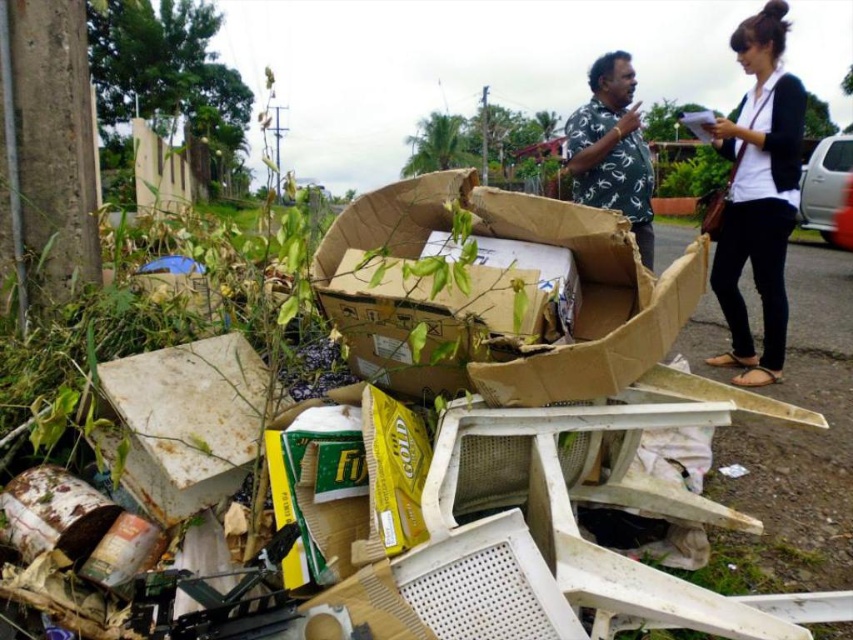
Who is taller, brown cardboard box at center or white matte shirt at upper right?

white matte shirt at upper right

Measure the distance between brown cardboard box at center and white matte shirt at upper right.

brown cardboard box at center is 2.26 meters away from white matte shirt at upper right.

Is point (582, 241) less distant than point (724, 221)?

That is True.

Identify the location of brown cardboard box at center. (500, 296).

Which is below, white matte shirt at upper right or white printed shirt at upper center?

white matte shirt at upper right

Does white matte shirt at upper right have a lesser height compared to white printed shirt at upper center?

No, white matte shirt at upper right is not shorter than white printed shirt at upper center.

Between point (753, 284) and point (595, 99), which one is positioned in front?

Point (595, 99)

Where is `white matte shirt at upper right`? The image size is (853, 640). white matte shirt at upper right is located at coordinates (758, 195).

Is point (399, 336) closer to viewer compared to point (635, 177)?

Yes, point (399, 336) is in front of point (635, 177).

Does point (450, 332) come behind point (604, 90)?

No, it is not.

Identify the location of brown cardboard box at center. The height and width of the screenshot is (640, 853). (500, 296).